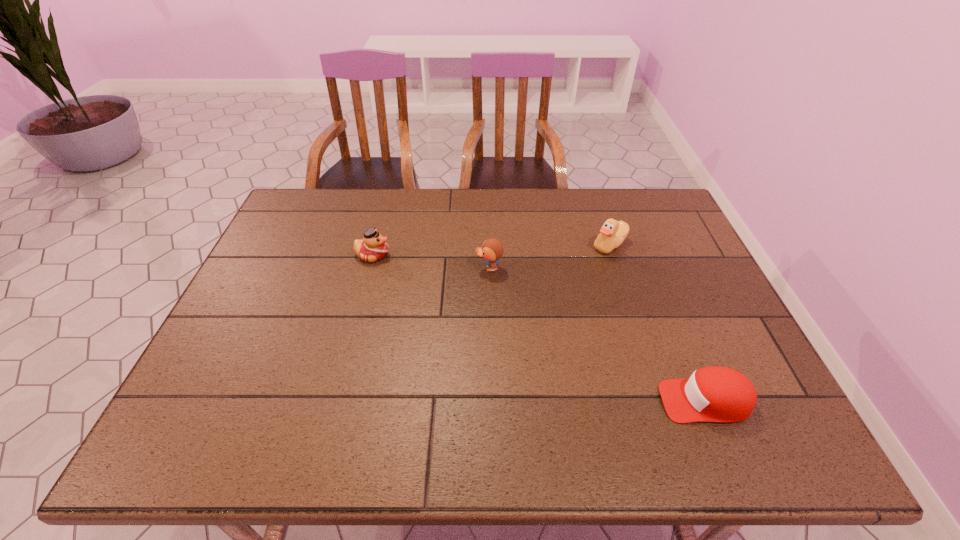
Where is `free point at the left edge`? This screenshot has width=960, height=540. free point at the left edge is located at coordinates (279, 274).

The image size is (960, 540). I want to click on blank area at the right edge, so click(727, 348).

Locate an element on the screen. This screenshot has height=540, width=960. vacant space at the near left corner of the desktop is located at coordinates (240, 426).

Identify the location of vacant space at the far right corner of the desktop. (681, 225).

Find the location of a particular element. The height and width of the screenshot is (540, 960). vacant point located between the baseball cap and the rightmost duck is located at coordinates (658, 323).

You are a GUI agent. You are given a task and a screenshot of the screen. Output one action in this format:
    pyautogui.click(x=<x>, y=<y>)
    Task: Click on the empty space that is in between the rightmost duck and the shortest object
    The width and height of the screenshot is (960, 540).
    Given the screenshot: What is the action you would take?
    pyautogui.click(x=658, y=323)

Locate an element on the screen. This screenshot has height=540, width=960. vacant region between the shortest object and the second object from left to right is located at coordinates (597, 334).

Locate an element on the screen. free spot between the nearest object and the second object from left to right is located at coordinates 597,334.

You are a GUI agent. You are given a task and a screenshot of the screen. Output one action in this format:
    pyautogui.click(x=<x>, y=<y>)
    Task: Click on the free space between the second duck from left to right and the baseball cap
    Image resolution: width=960 pixels, height=540 pixels.
    Given the screenshot: What is the action you would take?
    pyautogui.click(x=597, y=334)

Locate an element on the screen. free space between the third object from right to left and the baseball cap is located at coordinates (597, 334).